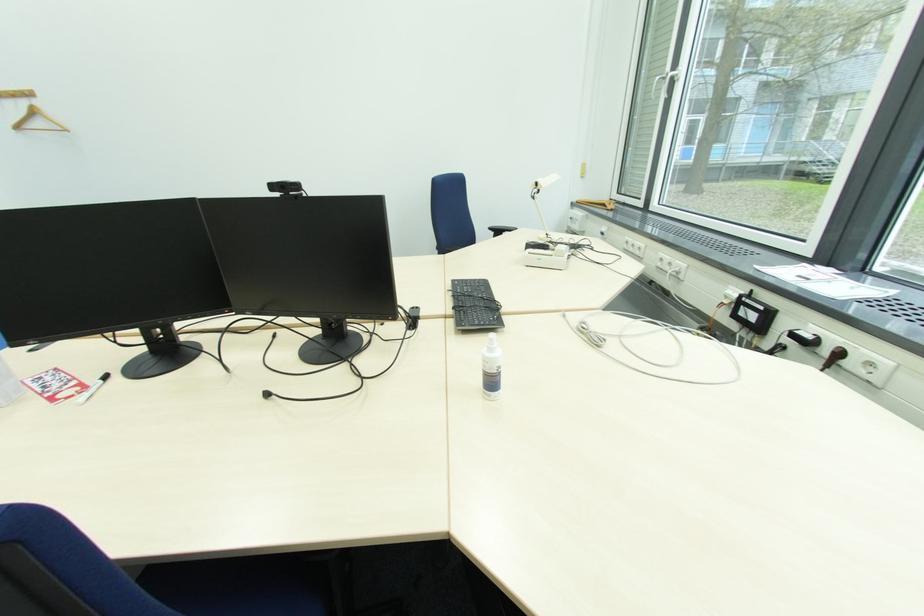
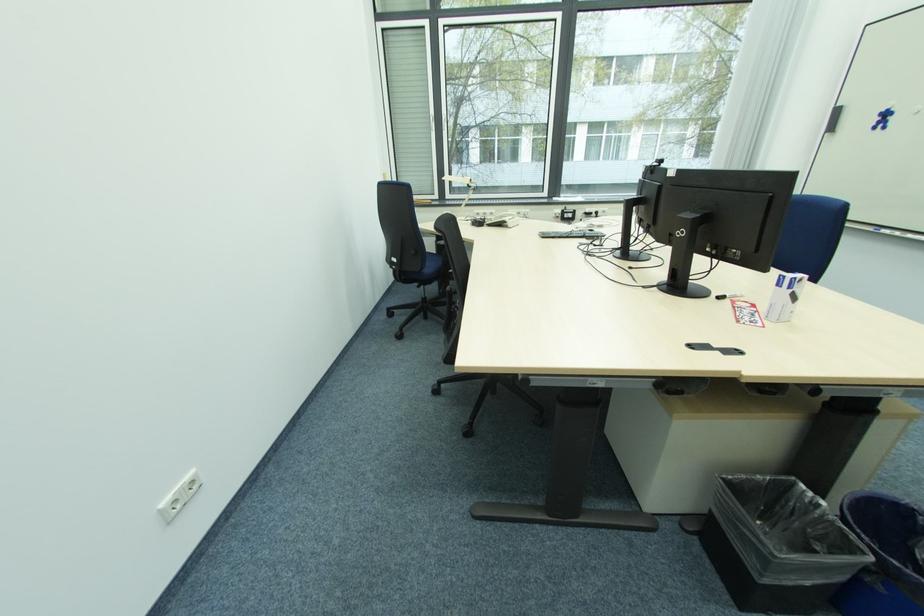
The point at (642, 251) is marked in the first image. Where is the corresponding point in the second image?

(494, 216)